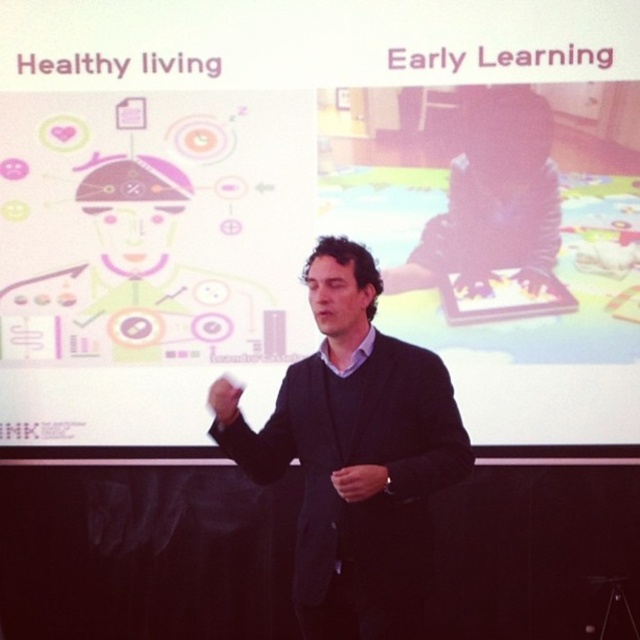
Question: Where is white matte projection screen at upper center located in relation to dark blue suit at center in the image?

Choices:
 (A) left
 (B) right

Answer: (A)

Question: Which point is closer to the camera taking this photo?

Choices:
 (A) (344, 540)
 (B) (481, 358)

Answer: (A)

Question: Can you confirm if white matte projection screen at upper center is bigger than dark blue suit at center?

Choices:
 (A) yes
 (B) no

Answer: (A)

Question: Which point is closer to the camera?

Choices:
 (A) (358, 234)
 (B) (349, 628)

Answer: (B)

Question: Is white matte projection screen at upper center thinner than dark blue suit at center?

Choices:
 (A) yes
 (B) no

Answer: (B)